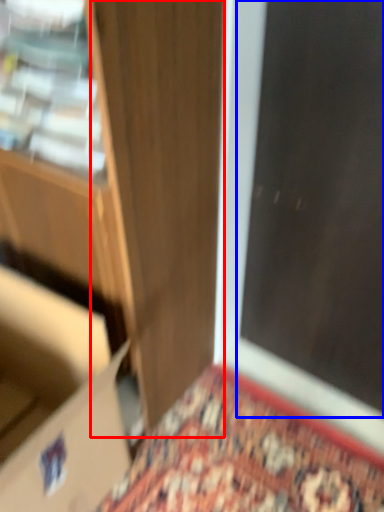
Question: Which object appears closest to the camera in this image, door (highlighted by a red box) or screen door (highlighted by a blue box)?

Choices:
 (A) door
 (B) screen door

Answer: (A)